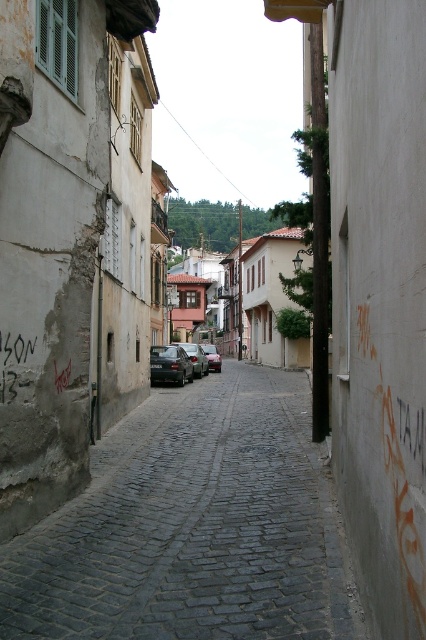
Question: Estimate the real-world distances between objects in this image. Which object is closer to the metallic gray car at center?

Choices:
 (A) shiny black sedan at center
 (B) brown wooden house at center
 (C) matte black car at center

Answer: (A)

Question: Is dark gray cobblestone alley at center closer to camera compared to matte black car at center?

Choices:
 (A) no
 (B) yes

Answer: (B)

Question: Is metallic gray car at center below matte black car at center?

Choices:
 (A) yes
 (B) no

Answer: (B)

Question: Among these points, which one is farthest from the camera?

Choices:
 (A) (293, 248)
 (B) (207, 346)
 (C) (172, 600)

Answer: (A)

Question: Which point is closer to the camera?

Choices:
 (A) brown wooden house at center
 (B) dark gray cobblestone alley at center

Answer: (B)

Question: Where is dark gray cobblestone alley at center located in relation to matte black car at center in the image?

Choices:
 (A) left
 (B) right

Answer: (B)